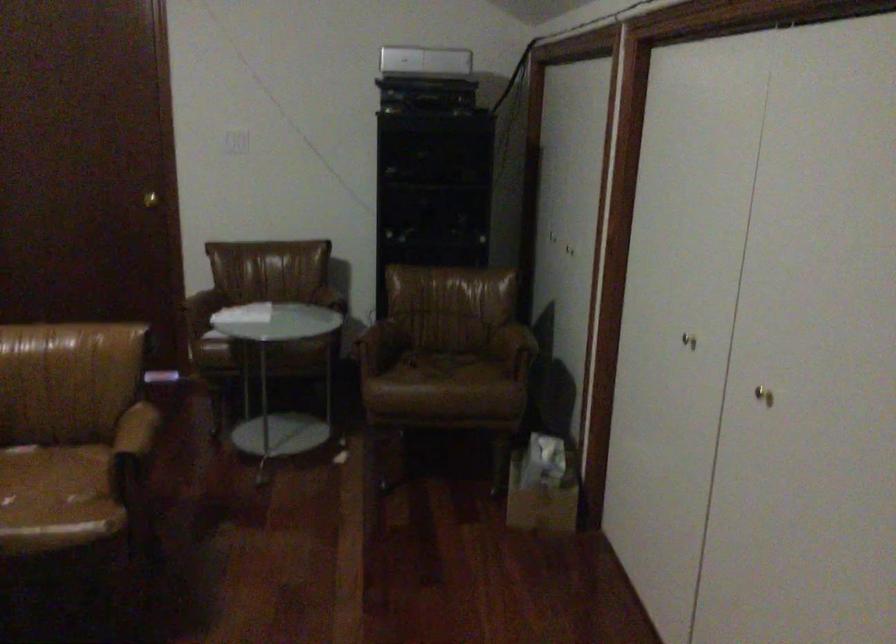
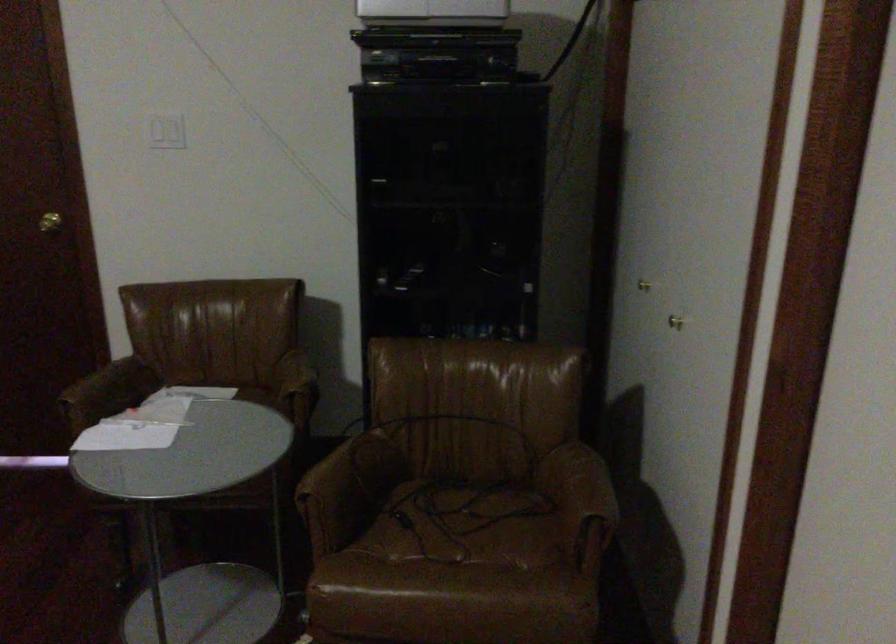
Question: I am providing you with two images of the same scene from different viewpoints. Please identify which objects are invisible in image2.

Choices:
 (A) brown chair sitting surface
 (B) closet door knob
 (C) gold door knob
 (D) none of these

Answer: (D)